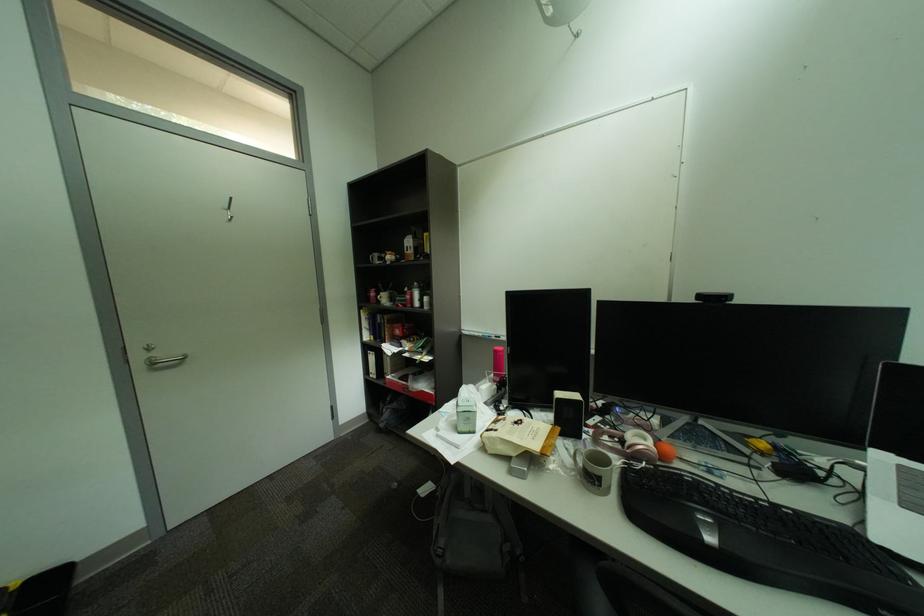
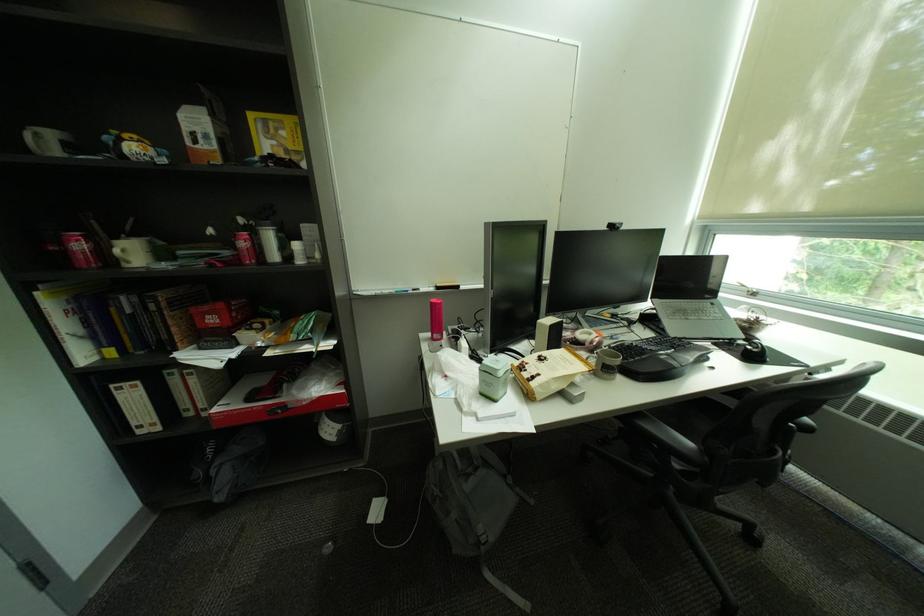
Find the pixel in the second image that matches the point at 383,296 in the first image.

(91, 246)